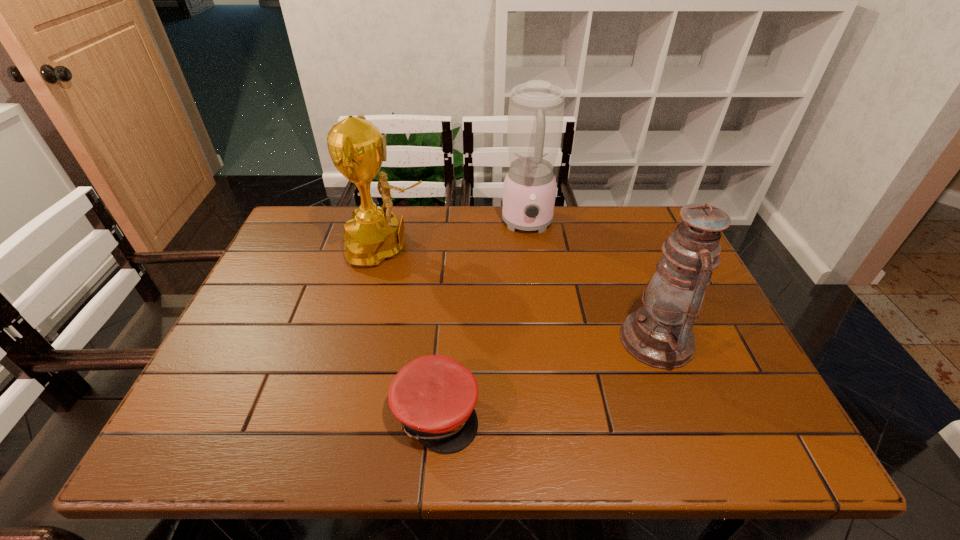
Identify the location of unoccupied position between the rightmost object and the second object from right to left. This screenshot has width=960, height=540. pos(592,282).

The image size is (960, 540). Find the location of `free space between the cap and the food processor`. free space between the cap and the food processor is located at coordinates (482, 318).

Identify the location of unoccupied position between the third object from left to right and the shortest object. The width and height of the screenshot is (960, 540). point(482,318).

Image resolution: width=960 pixels, height=540 pixels. Find the location of `blank region between the oil lamp and the food processor`. blank region between the oil lamp and the food processor is located at coordinates (592, 282).

Locate an element on the screen. Image resolution: width=960 pixels, height=540 pixels. vacant region between the third object from left to right and the award is located at coordinates (458, 235).

Identify the location of unoccupied position between the shortest object and the award. (412, 330).

I want to click on vacant space that is in between the cap and the award, so click(412, 330).

Where is `free space between the shortest object and the award`? The image size is (960, 540). free space between the shortest object and the award is located at coordinates (412, 330).

Locate which object ranks third in proximity to the food processor. Please provide its 2D coordinates. Your answer should be formatted as a tuple, i.e. [(x, y)], where the tuple contains the x and y coordinates of a point satisfying the conditions above.

[(434, 396)]

Identify which object is located as the nearest to the food processor. Please provide its 2D coordinates. Your answer should be formatted as a tuple, i.e. [(x, y)], where the tuple contains the x and y coordinates of a point satisfying the conditions above.

[(373, 234)]